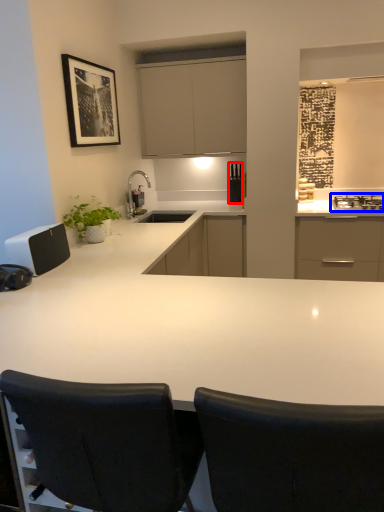
Question: Which object appears closest to the camera in this image, appliance (highlighted by a red box) or gas stove (highlighted by a blue box)?

Choices:
 (A) appliance
 (B) gas stove

Answer: (B)